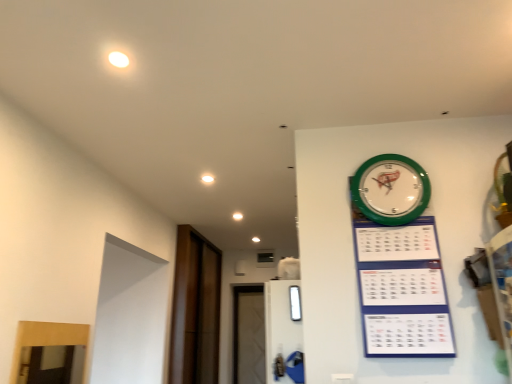
Question: Are brown wood door at left and green plastic calendar at upper right beside each other?

Choices:
 (A) yes
 (B) no

Answer: (B)

Question: Is brown wood door at left bigger than green plastic calendar at upper right?

Choices:
 (A) yes
 (B) no

Answer: (A)

Question: From a real-world perspective, is brown wood door at left below green plastic calendar at upper right?

Choices:
 (A) yes
 (B) no

Answer: (A)

Question: Is brown wood door at left smaller than green plastic calendar at upper right?

Choices:
 (A) no
 (B) yes

Answer: (A)

Question: Is brown wood door at left shorter than green plastic calendar at upper right?

Choices:
 (A) no
 (B) yes

Answer: (A)

Question: From a real-world perspective, is transparent glass window at center positioned above or below green plastic wall clock at upper right?

Choices:
 (A) above
 (B) below

Answer: (B)

Question: Considering the positions of transparent glass window at center and green plastic wall clock at upper right in the image, is transparent glass window at center taller or shorter than green plastic wall clock at upper right?

Choices:
 (A) short
 (B) tall

Answer: (A)

Question: Based on their sizes in the image, would you say transparent glass window at center is bigger or smaller than green plastic wall clock at upper right?

Choices:
 (A) big
 (B) small

Answer: (B)

Question: Do you think transparent glass window at center is within green plastic wall clock at upper right, or outside of it?

Choices:
 (A) inside
 (B) outside

Answer: (B)

Question: From the image's perspective, relative to green plastic calendar at upper right, is brown wood door at left above or below?

Choices:
 (A) below
 (B) above

Answer: (A)

Question: Considering the positions of brown wood door at left and green plastic calendar at upper right in the image, is brown wood door at left wider or thinner than green plastic calendar at upper right?

Choices:
 (A) wide
 (B) thin

Answer: (A)

Question: From a real-world perspective, is brown wood door at left above or below green plastic calendar at upper right?

Choices:
 (A) above
 (B) below

Answer: (B)

Question: Is point (212, 304) positioned closer to the camera than point (422, 306)?

Choices:
 (A) closer
 (B) farther

Answer: (B)

Question: In terms of width, does transparent glass window at center look wider or thinner when compared to white glossy light at upper center?

Choices:
 (A) wide
 (B) thin

Answer: (B)

Question: Considering the positions of transparent glass window at center and white glossy light at upper center in the image, is transparent glass window at center taller or shorter than white glossy light at upper center?

Choices:
 (A) short
 (B) tall

Answer: (B)